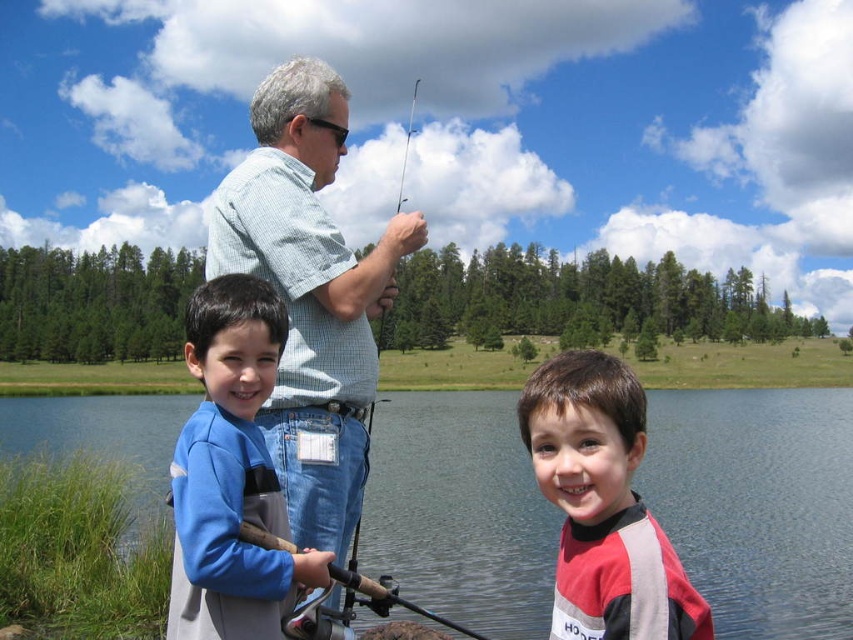
You are standing at the point with coordinates (x=758, y=504) in the image. What object is located exactly at this point?

The blue water at center is located exactly at point (x=758, y=504).

You are a photographer trying to capture a photo of the blue water at center and the red and gray wetsuit at center. From the photographer perspective, which object is positioned to the left?

The blue water at center is to the left of the red and gray wetsuit at center, so the blue water at center is positioned to the left.

You are a photographer standing at the edge of the lake, wanting to capture a photo of both the blue fleece jacket at left and the red and gray wetsuit at center in the same frame. Given that your camera has a focal length of 50mm and a sensor size of 24mm x 36mm, can you determine if the two subjects are within the camera sensor field of view? Please explain your reasoning.

The distance between the blue fleece jacket at left and the red and gray wetsuit at center is 5.21 meters. To determine if they fit within the camera sensor field of view, we first calculate the horizontal field of view using the formula Field of View in degrees equals 2 times arctangent of sensor width divided by 2 times focal length. Plugging in the numbers, Field of View equals 2 times arctangent of 24 divided by 2 times 50, which results in approximately 27.6 degrees. Converting this angle to distance,